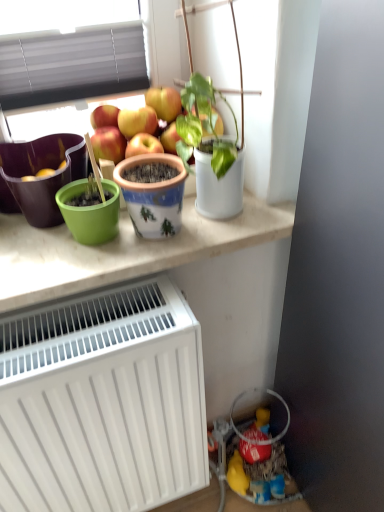
Where is `free spot to the right of painted ceramic pot at center, which ranks as the 1th flowerpot in right-to-left order`? The height and width of the screenshot is (512, 384). free spot to the right of painted ceramic pot at center, which ranks as the 1th flowerpot in right-to-left order is located at coordinates (240, 229).